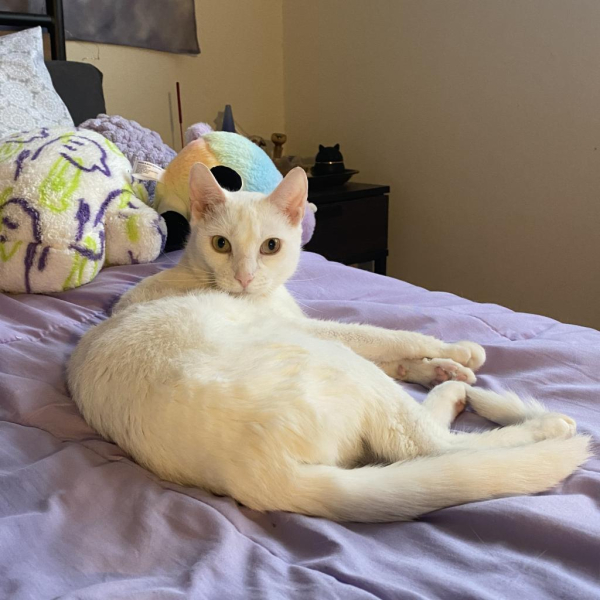
I want to click on sheet, so click(x=420, y=299).